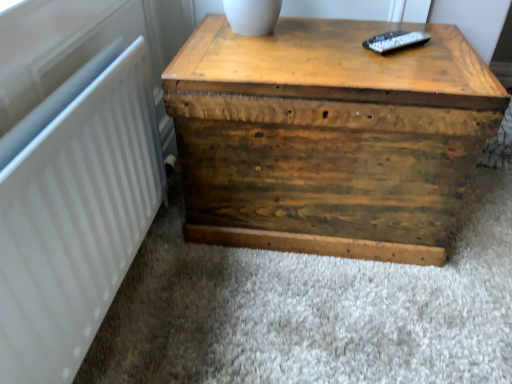
Question: From a real-world perspective, relative to wooden trunk at center, is white matte radiator at left vertically above or below?

Choices:
 (A) below
 (B) above

Answer: (B)

Question: Considering the positions of white matte radiator at left and wooden trunk at center in the image, is white matte radiator at left bigger or smaller than wooden trunk at center?

Choices:
 (A) big
 (B) small

Answer: (B)

Question: From the image's perspective, is white matte radiator at left positioned above or below wooden trunk at center?

Choices:
 (A) below
 (B) above

Answer: (A)

Question: Does point (360, 46) appear closer or farther from the camera than point (111, 211)?

Choices:
 (A) closer
 (B) farther

Answer: (B)

Question: Is wooden trunk at center wider or thinner than white matte radiator at left?

Choices:
 (A) thin
 (B) wide

Answer: (B)

Question: Is wooden trunk at center situated inside white matte radiator at left or outside?

Choices:
 (A) inside
 (B) outside

Answer: (B)

Question: Is wooden trunk at center in front of or behind white matte radiator at left in the image?

Choices:
 (A) front
 (B) behind

Answer: (B)